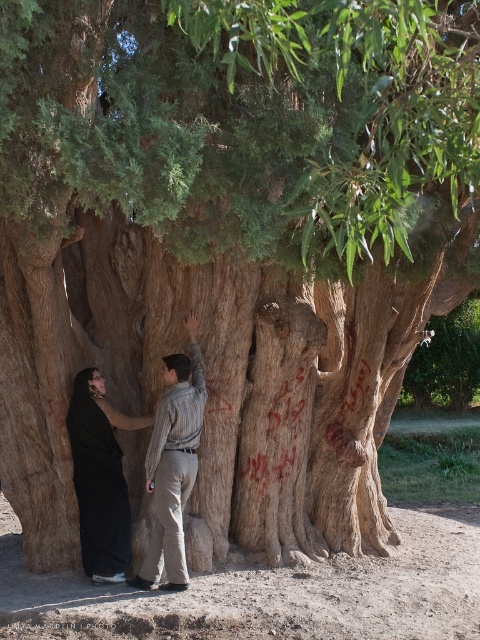
You are a fashion designer observing the scene. You need to create a new outfit that combines elements from both the striped shirt at center and the black matte dress at left. Which item should you use as the base for the outfit to ensure it is not too tight? Explain your choice based on their sizes.

The striped shirt at center is thinner than the black matte dress at left. To ensure the outfit is not too tight, you should use the black matte dress at left as the base since it is wider and less restrictive.

You are a photographer trying to capture both the striped shirt at center and the black matte dress at left in a single frame. Which one will appear larger in the photo?

The striped shirt at center will appear larger in the photo because it is closer to the viewer than the black matte dress at left.